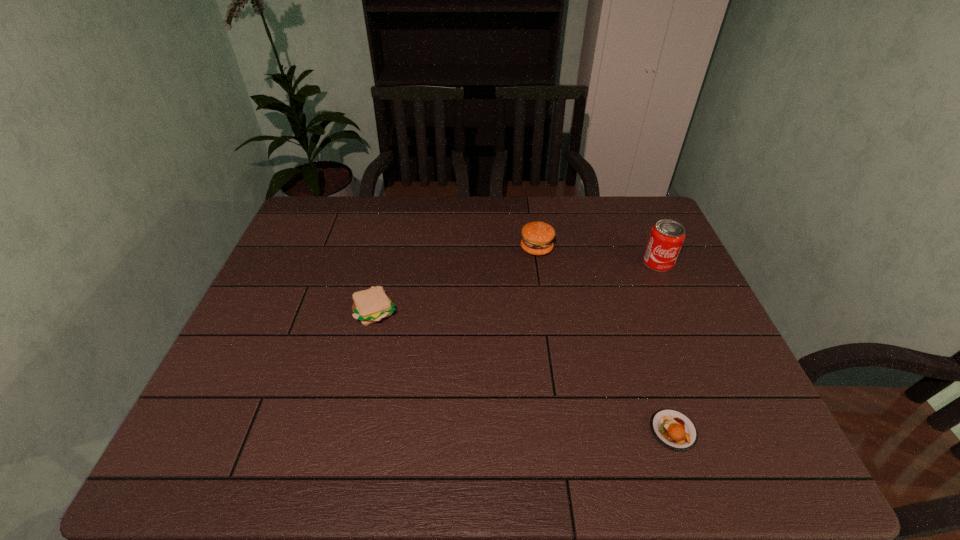
At what (x,y) coordinates should I click in order to perform the action: click on vacant area that lies between the third shortest object and the rightmost object. Please return your answer as a coordinate pair (x, y). Looking at the image, I should click on (597, 255).

Where is `empty space between the rightmost object and the second shortest object`? empty space between the rightmost object and the second shortest object is located at coordinates (517, 287).

Locate an element on the screen. empty space that is in between the second patty (food) from left to right and the second tallest patty (food) is located at coordinates (456, 280).

You are a GUI agent. You are given a task and a screenshot of the screen. Output one action in this format:
    pyautogui.click(x=<x>, y=<y>)
    Task: Click on the object that can be found as the second closest to the nearest patty (food)
    The image size is (960, 540).
    Given the screenshot: What is the action you would take?
    pyautogui.click(x=537, y=237)

Locate which object ranks second in proximity to the rightmost object. Please provide its 2D coordinates. Your answer should be formatted as a tuple, i.e. [(x, y)], where the tuple contains the x and y coordinates of a point satisfying the conditions above.

[(674, 430)]

Identify which patty (food) is the second nearest to the shortest patty (food). Please provide its 2D coordinates. Your answer should be formatted as a tuple, i.e. [(x, y)], where the tuple contains the x and y coordinates of a point satisfying the conditions above.

[(371, 305)]

I want to click on the closest patty (food) to the farthest patty (food), so click(371, 305).

Where is `free location that satisfies the following two spatial constraints: 1. on the front side of the third object from right to left; 2. on the left side of the nearest patty (food)`? The height and width of the screenshot is (540, 960). free location that satisfies the following two spatial constraints: 1. on the front side of the third object from right to left; 2. on the left side of the nearest patty (food) is located at coordinates (564, 430).